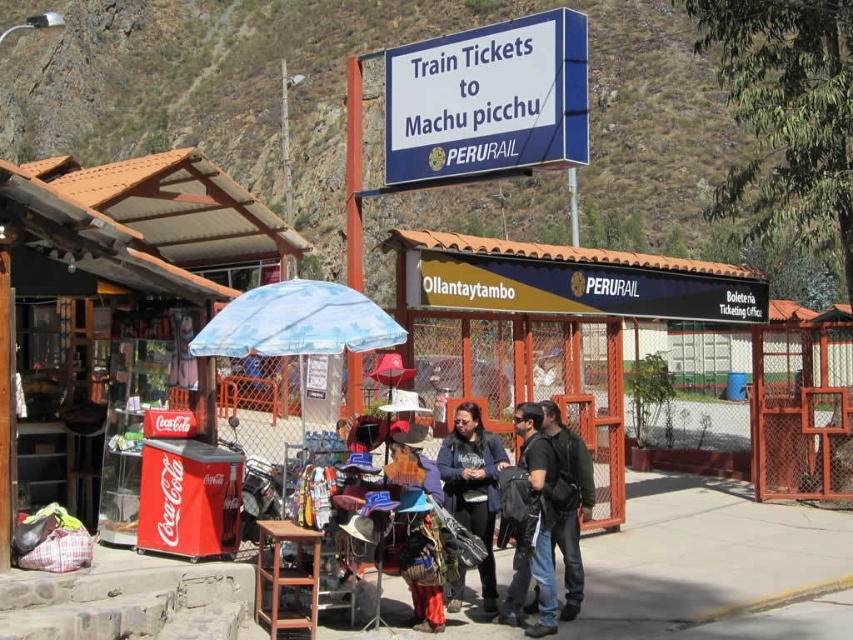
You are standing at the train station for Machu Picchu tickets. There is a point marked at coordinates (714,564). What type of surface is this point located on?

The point at (714,564) is located on concrete pavement at center.